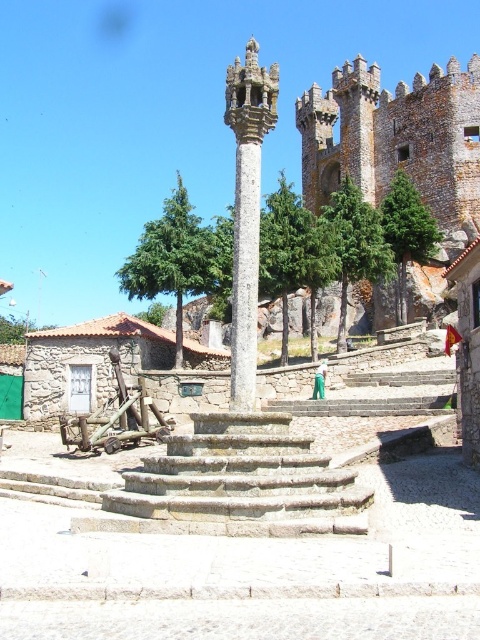
Who is positioned more to the right, stone steps at center or smooth stone column at center?

smooth stone column at center is more to the right.

Which is below, stone steps at center or smooth stone column at center?

stone steps at center is lower down.

Which is in front, point (208, 483) or point (252, 129)?

Point (208, 483)

Locate an element on the screen. stone steps at center is located at coordinates (235, 484).

Find the location of `stone steps at center`. stone steps at center is located at coordinates (235, 484).

Can you confirm if stone steps at center is thinner than stone textured castle at upper right?

Indeed, stone steps at center has a lesser width compared to stone textured castle at upper right.

Where is `stone steps at center`? The height and width of the screenshot is (640, 480). stone steps at center is located at coordinates (235, 484).

Where is `stone steps at center`? stone steps at center is located at coordinates (235, 484).

Describe the element at coordinates (395, 136) in the screenshot. I see `stone textured castle at upper right` at that location.

At what (x,y) coordinates should I click in order to perform the action: click on stone textured castle at upper right. Please return your answer as a coordinate pair (x, y). The width and height of the screenshot is (480, 640). Looking at the image, I should click on (395, 136).

You are a GUI agent. You are given a task and a screenshot of the screen. Output one action in this format:
    pyautogui.click(x=<x>, y=<y>)
    Task: Click on the stone textured castle at upper right
    This screenshot has height=640, width=480.
    Given the screenshot: What is the action you would take?
    pyautogui.click(x=395, y=136)